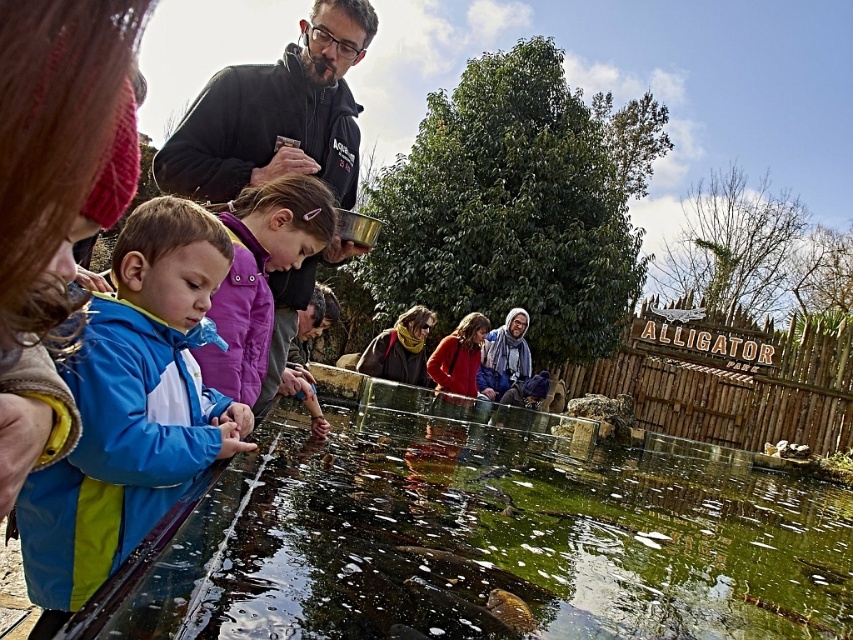
Can you confirm if blue waterproof jacket at left is thinner than dark gray jacket at upper left?

Yes, blue waterproof jacket at left is thinner than dark gray jacket at upper left.

Based on the photo, who is shorter, blue waterproof jacket at left or dark gray jacket at upper left?

With less height is blue waterproof jacket at left.

What do you see at coordinates (131, 410) in the screenshot? I see `blue waterproof jacket at left` at bounding box center [131, 410].

Locate an element on the screen. The height and width of the screenshot is (640, 853). blue waterproof jacket at left is located at coordinates (131, 410).

Identify the location of green glassy water at lower center. Image resolution: width=853 pixels, height=640 pixels. point(480,538).

Who is positioned more to the left, green glassy water at lower center or blue waterproof jacket at left?

Positioned to the left is blue waterproof jacket at left.

Image resolution: width=853 pixels, height=640 pixels. What do you see at coordinates (480, 538) in the screenshot? I see `green glassy water at lower center` at bounding box center [480, 538].

Is point (329, 556) positioned behind point (111, 552)?

That is True.

I want to click on green glassy water at lower center, so click(480, 538).